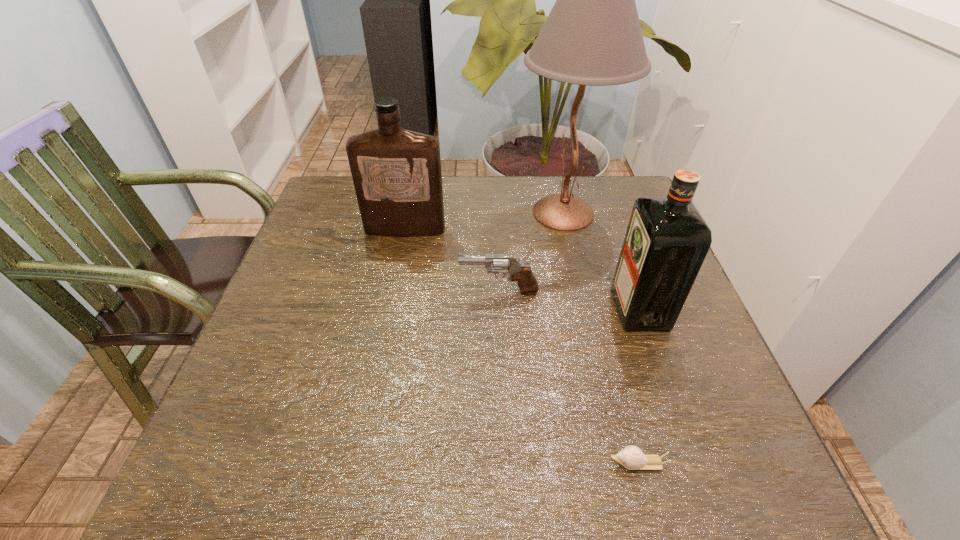
Identify the location of free space located on the label side of the left liquor. (393, 291).

In order to click on vacant space located on the front label of the right liquor in this screenshot , I will do `click(515, 308)`.

At what (x,y) coordinates should I click in order to perform the action: click on vacant space located 0.150m on the front label of the right liquor. Please return your answer as a coordinate pair (x, y). The image size is (960, 540). Looking at the image, I should click on (547, 308).

What are the coordinates of `vacant region located on the front label of the right liquor` in the screenshot? It's located at (593, 308).

Locate an element on the screen. free location located at the barrel of the second shortest object is located at coordinates (374, 292).

The height and width of the screenshot is (540, 960). Find the location of `free point located at the barrel of the second shortest object`. free point located at the barrel of the second shortest object is located at coordinates (316, 292).

This screenshot has height=540, width=960. In order to click on blank space located 0.250m at the barrel of the second shortest object in this screenshot , I will do `click(348, 292)`.

Locate an element on the screen. The image size is (960, 540). blank space located 0.320m on the shell of the shortest object is located at coordinates (413, 463).

Find the location of a particular element. The height and width of the screenshot is (540, 960). blank space located on the shell of the shortest object is located at coordinates (488, 463).

Identify the location of free location located 0.080m on the shell of the shortest object. (562, 463).